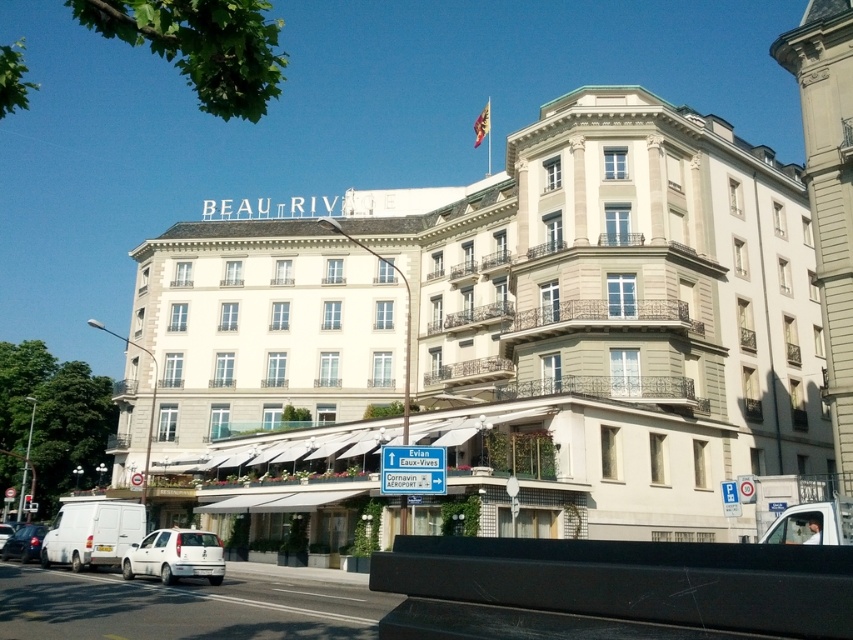
Question: Can you confirm if white stone building at center is smaller than silver metallic van at lower left?

Choices:
 (A) yes
 (B) no

Answer: (B)

Question: Is silver metallic van at lower left below white matte car at lower left?

Choices:
 (A) no
 (B) yes

Answer: (A)

Question: Which point is closer to the camera taking this photo?

Choices:
 (A) (209, 353)
 (B) (218, 547)
 (C) (25, 557)
 (D) (6, 531)

Answer: (B)

Question: Is silver metallic van at lower left wider than white matte car at lower left?

Choices:
 (A) yes
 (B) no

Answer: (A)

Question: Considering the real-world distances, which object is farthest from the white matte van at lower right?

Choices:
 (A) silver metallic van at lower left
 (B) white stone building at center
 (C) white matte car at lower left
 (D) white matte van at lower left

Answer: (C)

Question: Which of the following is the closest to the observer?

Choices:
 (A) white stone building at center
 (B) white matte van at lower left
 (C) white matte van at lower right

Answer: (C)